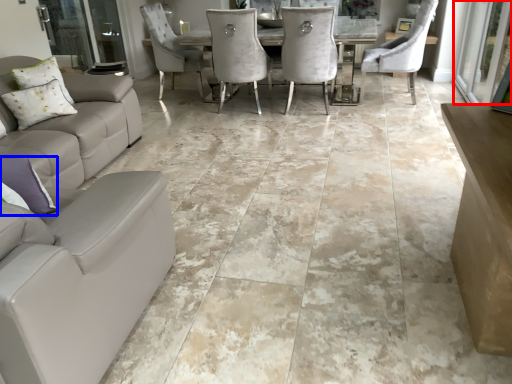
Question: Which of the following is the farthest to the observer, screen door (highlighted by a red box) or pillow (highlighted by a blue box)?

Choices:
 (A) screen door
 (B) pillow

Answer: (A)